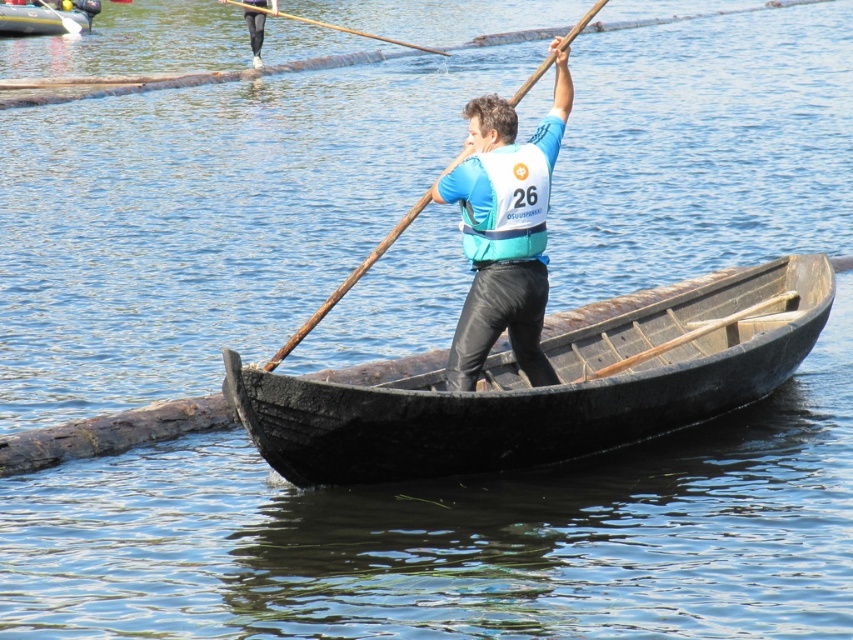
Question: Is wooden at center closer to the viewer compared to black leggings at upper center?

Choices:
 (A) yes
 (B) no

Answer: (A)

Question: Among these objects, which one is farthest from the camera?

Choices:
 (A) wooden textured paddle at center
 (B) blue fabric life vest at center

Answer: (A)

Question: Is wooden at center to the left of wooden paddle at upper center from the viewer's perspective?

Choices:
 (A) no
 (B) yes

Answer: (A)

Question: Which object is the closest to the wooden at center?

Choices:
 (A) blue fabric life vest at center
 (B) wooden textured paddle at center
 (C) rubberized inflatable boat at upper left
 (D) black leggings at upper center

Answer: (B)

Question: Does wooden at center appear on the left side of wooden paddle at upper center?

Choices:
 (A) yes
 (B) no

Answer: (B)

Question: Which point is closer to the camera?

Choices:
 (A) blue fabric life vest at center
 (B) wooden at center
 (C) rubberized inflatable boat at upper left
 (D) wooden paddle at upper center

Answer: (B)